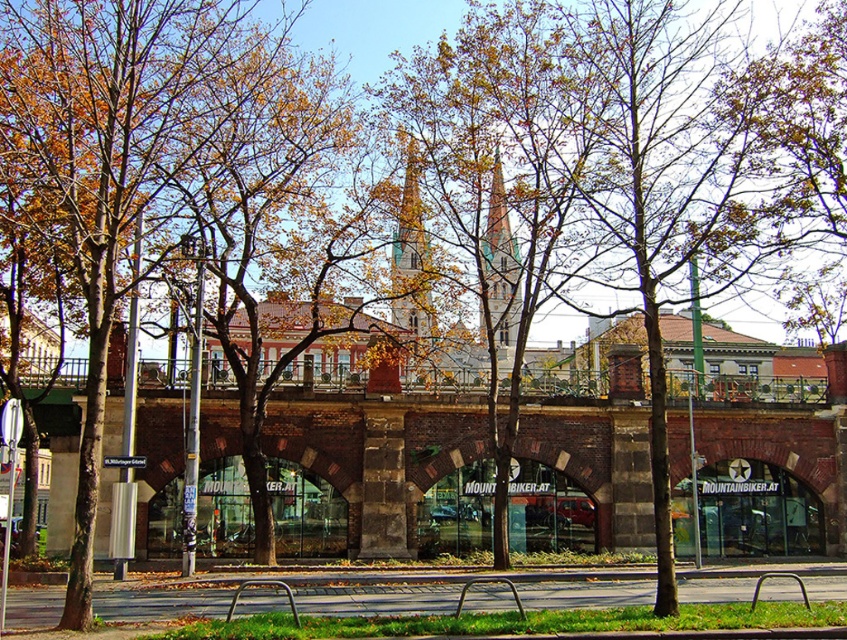
Is brown stone bridge at center closer to camera compared to green stone spire at center?

No, it is not.

Is brown stone bridge at center wider than green stone spire at center?

Correct, the width of brown stone bridge at center exceeds that of green stone spire at center.

At what (x,y) coordinates should I click in order to perform the action: click on brown stone bridge at center. Please return your answer as a coordinate pair (x, y). This screenshot has height=640, width=847. Looking at the image, I should click on (380, 474).

Where is `brown stone bridge at center`? Image resolution: width=847 pixels, height=640 pixels. brown stone bridge at center is located at coordinates (380, 474).

Is point (837, 472) farther from viewer compared to point (43, 182)?

Yes, it is.

Between point (336, 419) and point (45, 36), which one is positioned in front?

Point (45, 36)

Identify the location of brown stone bridge at center. This screenshot has width=847, height=640. (380, 474).

Which is below, brown leafy tree at left or metallic silver bench at center?

metallic silver bench at center

Can you confirm if brown leafy tree at left is thinner than metallic silver bench at center?

In fact, brown leafy tree at left might be wider than metallic silver bench at center.

You are a GUI agent. You are given a task and a screenshot of the screen. Output one action in this format:
    pyautogui.click(x=<x>, y=<y>)
    Task: Click on the brown leafy tree at left
    The image size is (847, 640).
    Given the screenshot: What is the action you would take?
    pyautogui.click(x=118, y=156)